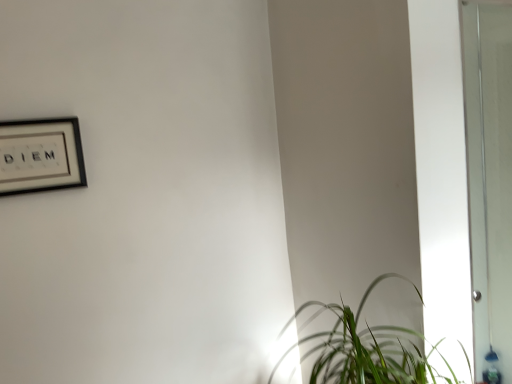
Question: Is green leafy plant at lower right oriented away from black matte picture frame at upper left?

Choices:
 (A) no
 (B) yes

Answer: (A)

Question: Is green leafy plant at lower right next to black matte picture frame at upper left?

Choices:
 (A) yes
 (B) no

Answer: (B)

Question: From the image's perspective, would you say green leafy plant at lower right is shown under black matte picture frame at upper left?

Choices:
 (A) no
 (B) yes

Answer: (B)

Question: Is there a large distance between green leafy plant at lower right and black matte picture frame at upper left?

Choices:
 (A) yes
 (B) no

Answer: (A)

Question: Is green leafy plant at lower right at the right side of black matte picture frame at upper left?

Choices:
 (A) no
 (B) yes

Answer: (B)

Question: From a real-world perspective, is green leafy plant at lower right below black matte picture frame at upper left?

Choices:
 (A) no
 (B) yes

Answer: (B)

Question: Does black matte picture frame at upper left lie in front of green leafy plant at lower right?

Choices:
 (A) no
 (B) yes

Answer: (A)

Question: Is black matte picture frame at upper left bigger than green leafy plant at lower right?

Choices:
 (A) yes
 (B) no

Answer: (B)

Question: Is black matte picture frame at upper left facing away from green leafy plant at lower right?

Choices:
 (A) yes
 (B) no

Answer: (B)

Question: Can you confirm if black matte picture frame at upper left is taller than green leafy plant at lower right?

Choices:
 (A) yes
 (B) no

Answer: (B)

Question: Considering the relative sizes of black matte picture frame at upper left and green leafy plant at lower right in the image provided, is black matte picture frame at upper left smaller than green leafy plant at lower right?

Choices:
 (A) yes
 (B) no

Answer: (A)

Question: Is the position of black matte picture frame at upper left more distant than that of green leafy plant at lower right?

Choices:
 (A) yes
 (B) no

Answer: (A)

Question: Based on their sizes in the image, would you say black matte picture frame at upper left is bigger or smaller than green leafy plant at lower right?

Choices:
 (A) small
 (B) big

Answer: (A)